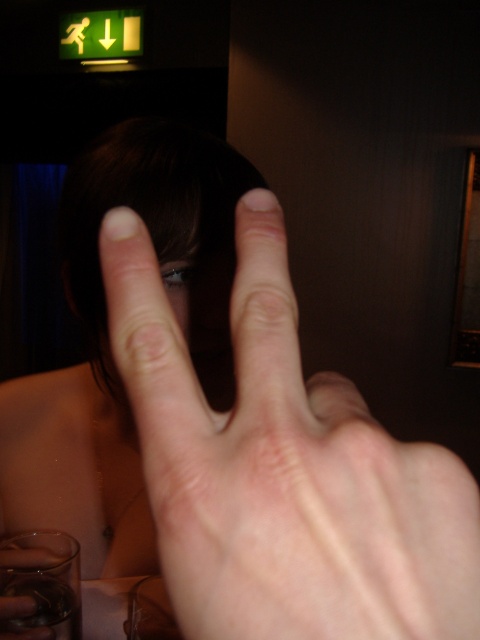
Question: Does pale skin hand at center have a smaller size compared to clear glass at lower left?

Choices:
 (A) no
 (B) yes

Answer: (A)

Question: Is pale skin hand at center wider than clear glass at lower left?

Choices:
 (A) no
 (B) yes

Answer: (B)

Question: Among these points, which one is nearest to the camera?

Choices:
 (A) (44, 580)
 (B) (407, 504)

Answer: (B)

Question: Where is pale skin hand at center located in relation to clear glass at lower left in the image?

Choices:
 (A) below
 (B) above

Answer: (B)